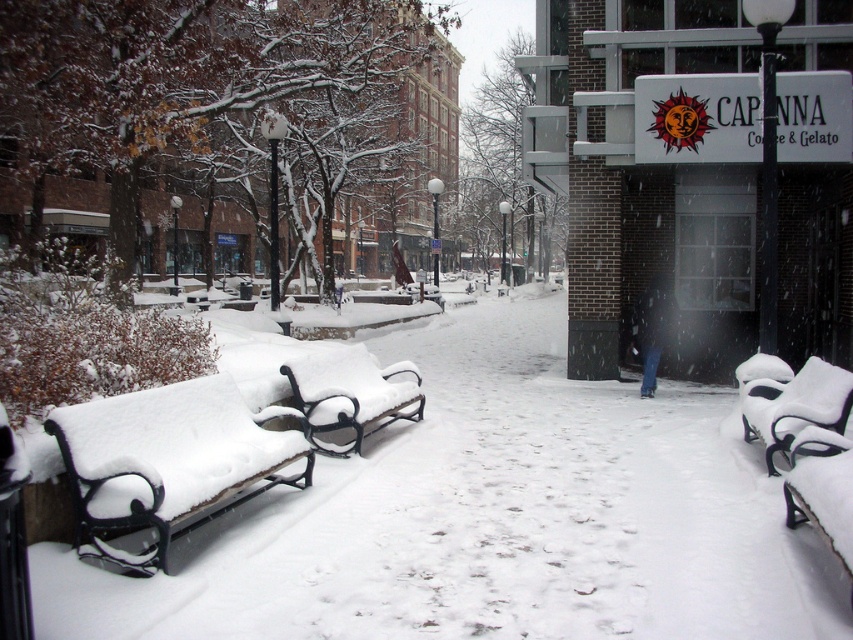
The width and height of the screenshot is (853, 640). I want to click on snow-covered metal bench at left, so click(169, 460).

Is snow-covered metal bench at left thinner than snow-covered metal bench at center?

Correct, snow-covered metal bench at left's width is less than snow-covered metal bench at center's.

The width and height of the screenshot is (853, 640). Find the location of `snow-covered metal bench at left`. snow-covered metal bench at left is located at coordinates (169, 460).

Identify the location of snow-covered metal bench at center. The width and height of the screenshot is (853, 640). (350, 394).

Can you confirm if snow-covered metal bench at center is positioned to the left of white matte park bench at lower right?

Indeed, snow-covered metal bench at center is positioned on the left side of white matte park bench at lower right.

Identify the location of snow-covered metal bench at center. (350, 394).

Does snow-covered metal bench at left appear on the left side of white matte park bench at lower right?

Correct, you'll find snow-covered metal bench at left to the left of white matte park bench at lower right.

Is point (173, 477) positioned in front of point (756, 404)?

Yes, point (173, 477) is closer to viewer.

Does point (254, 448) come farther from viewer compared to point (786, 365)?

No, (254, 448) is in front of (786, 365).

The image size is (853, 640). Find the location of `snow-covered metal bench at left`. snow-covered metal bench at left is located at coordinates (169, 460).